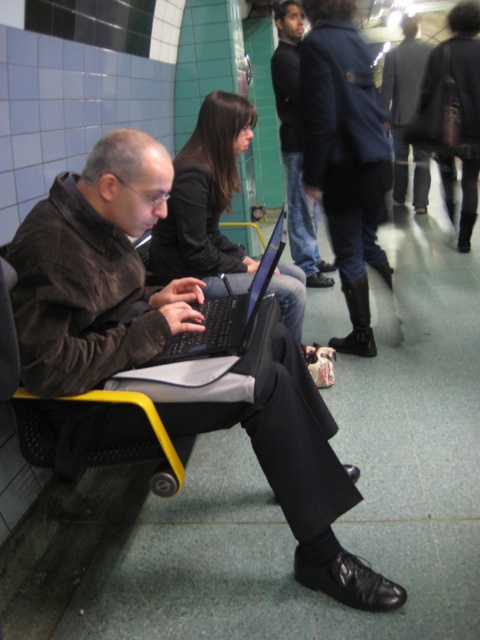
Who is higher up, dark blue leather jacket at center or black matte laptop at center?

dark blue leather jacket at center

Between point (384, 170) and point (210, 320), which one is positioned in front?

Point (210, 320) is more forward.

At what (x,y) coordinates should I click in order to perform the action: click on dark blue leather jacket at center. Please return your answer as a coordinate pair (x, y). Looking at the image, I should click on (345, 156).

At what (x,y) coordinates should I click in order to perform the action: click on matte black laptop at center. Please return your answer as a coordinate pair (x, y). This screenshot has width=480, height=640. Looking at the image, I should click on (159, 352).

Describe the element at coordinates (159, 352) in the screenshot. I see `matte black laptop at center` at that location.

The height and width of the screenshot is (640, 480). Describe the element at coordinates (159, 352) in the screenshot. I see `matte black laptop at center` at that location.

The image size is (480, 640). Find the location of `matte black laptop at center`. matte black laptop at center is located at coordinates (159, 352).

The height and width of the screenshot is (640, 480). Identify the location of matte black laptop at center. (159, 352).

Who is more forward, (130, 164) or (194, 356)?

Point (130, 164)

I want to click on matte black laptop at center, so click(159, 352).